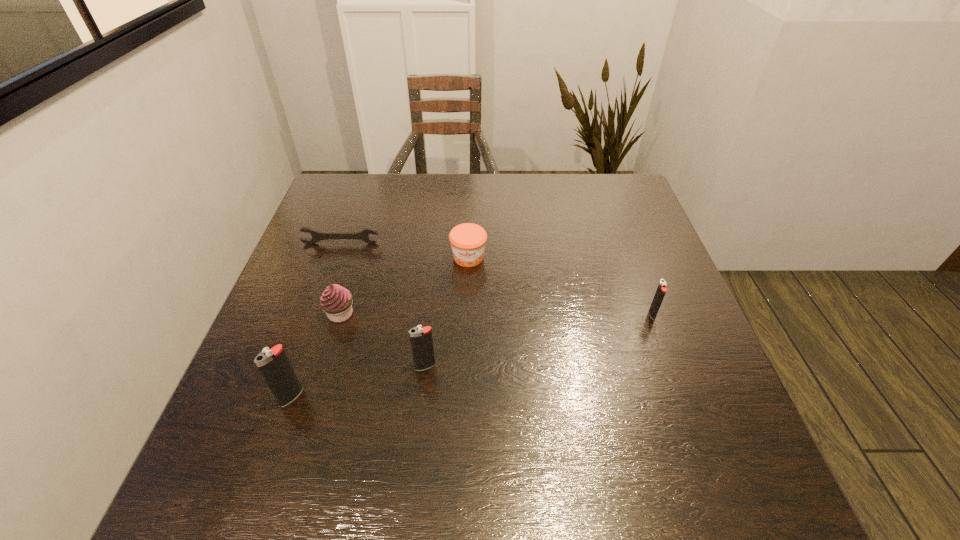
Where is `free spot between the fifth object from left to right and the second nearest igniter`? This screenshot has width=960, height=540. free spot between the fifth object from left to right and the second nearest igniter is located at coordinates (446, 312).

Image resolution: width=960 pixels, height=540 pixels. In order to click on vacant area that lies between the leftmost igniter and the wrench in this screenshot , I will do `click(316, 320)`.

Locate an element on the screen. This screenshot has width=960, height=540. free space between the rightmost igniter and the cupcake is located at coordinates (496, 314).

Image resolution: width=960 pixels, height=540 pixels. Find the location of `vacant region between the farthest object and the tallest object`. vacant region between the farthest object and the tallest object is located at coordinates (316, 320).

Where is `free spot between the second farthest igniter and the farthest object`? The height and width of the screenshot is (540, 960). free spot between the second farthest igniter and the farthest object is located at coordinates (383, 305).

Where is `blank region between the cupcake and the wrench`? This screenshot has height=540, width=960. blank region between the cupcake and the wrench is located at coordinates (341, 279).

Locate an element on the screen. This screenshot has height=540, width=960. unoccupied area between the wrench and the cupcake is located at coordinates (341, 279).

This screenshot has height=540, width=960. Identify the location of vacant area that lies between the cupcake and the farthest igniter. (496, 314).

I want to click on object that can be found as the fourth closest to the cupcake, so click(x=468, y=240).

Image resolution: width=960 pixels, height=540 pixels. Find the location of `the fourth closest object to the rightmost object`. the fourth closest object to the rightmost object is located at coordinates (317, 236).